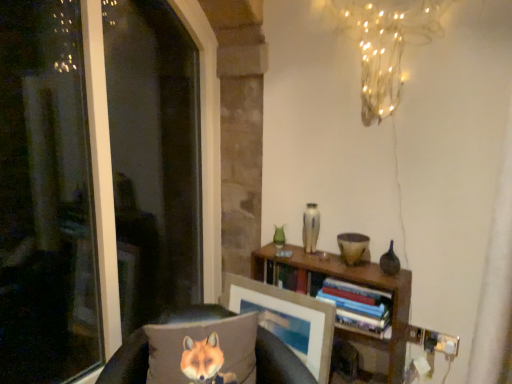
Question: Is hardcover books at center wider than wooden bookshelf at center?

Choices:
 (A) yes
 (B) no

Answer: (A)

Question: Is hardcover books at center facing towards wooden bookshelf at center?

Choices:
 (A) yes
 (B) no

Answer: (A)

Question: Is wooden bookshelf at center completely or partially inside hardcover books at center?

Choices:
 (A) no
 (B) yes

Answer: (A)

Question: Is hardcover books at center further to camera compared to wooden bookshelf at center?

Choices:
 (A) no
 (B) yes

Answer: (A)

Question: From the image's perspective, is hardcover books at center beneath wooden bookshelf at center?

Choices:
 (A) yes
 (B) no

Answer: (B)

Question: Considering the relative sizes of hardcover books at center and wooden bookshelf at center in the image provided, is hardcover books at center bigger than wooden bookshelf at center?

Choices:
 (A) no
 (B) yes

Answer: (A)

Question: Is wooden bookshelf at center directly adjacent to textured gray pillow with fox print at lower left?

Choices:
 (A) yes
 (B) no

Answer: (B)

Question: Considering the relative sizes of wooden bookshelf at center and textured gray pillow with fox print at lower left in the image provided, is wooden bookshelf at center shorter than textured gray pillow with fox print at lower left?

Choices:
 (A) no
 (B) yes

Answer: (A)

Question: From a real-world perspective, is wooden bookshelf at center on top of textured gray pillow with fox print at lower left?

Choices:
 (A) yes
 (B) no

Answer: (B)

Question: Does wooden bookshelf at center have a larger size compared to textured gray pillow with fox print at lower left?

Choices:
 (A) yes
 (B) no

Answer: (A)

Question: Considering the relative sizes of wooden bookshelf at center and textured gray pillow with fox print at lower left in the image provided, is wooden bookshelf at center wider than textured gray pillow with fox print at lower left?

Choices:
 (A) yes
 (B) no

Answer: (A)

Question: Does wooden bookshelf at center have a greater height compared to textured gray pillow with fox print at lower left?

Choices:
 (A) no
 (B) yes

Answer: (B)

Question: Could you tell me if brown fabric pillow at lower left is turned towards textured gray pillow with fox print at lower left?

Choices:
 (A) no
 (B) yes

Answer: (B)